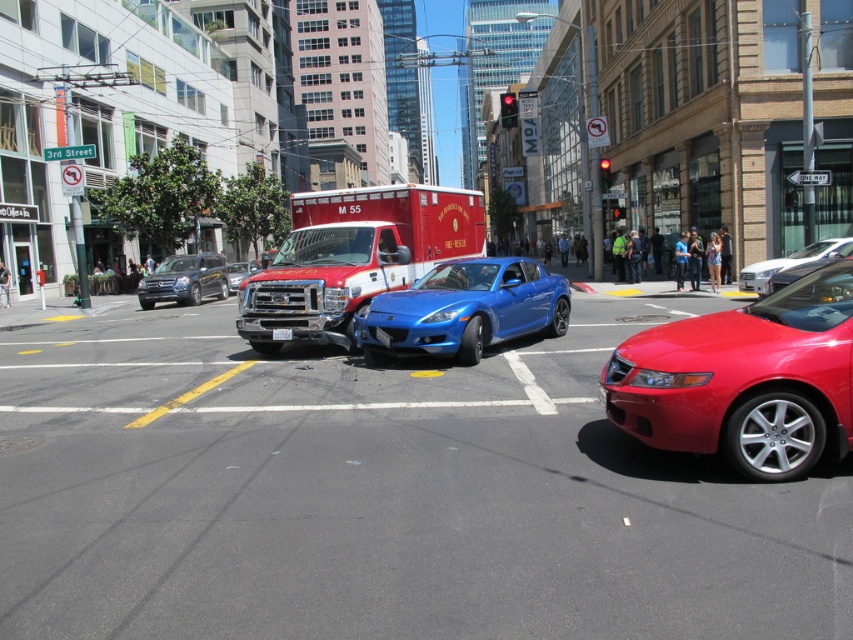
You are a traffic officer assessing the scene. You see the red matte fire truck at center and the matte black suv at left. Which vehicle should you prioritize inspecting for potential safety hazards based on their sizes?

The red matte fire truck at center is bigger than the matte black suv at left, so it should be prioritized for inspection as larger vehicles may pose greater risks in collisions.

You are a pedestrian standing at the intersection where the collision occurred between the red fire truck and the blue sports car. You notice two points marked on the road at coordinates point (343,580) and point (238,276). Which point is closer to you if you are facing north?

Point (343,580) is in front of point (238,276), so if you are facing north, point (343,580) would be closer to you since it is positioned in front.